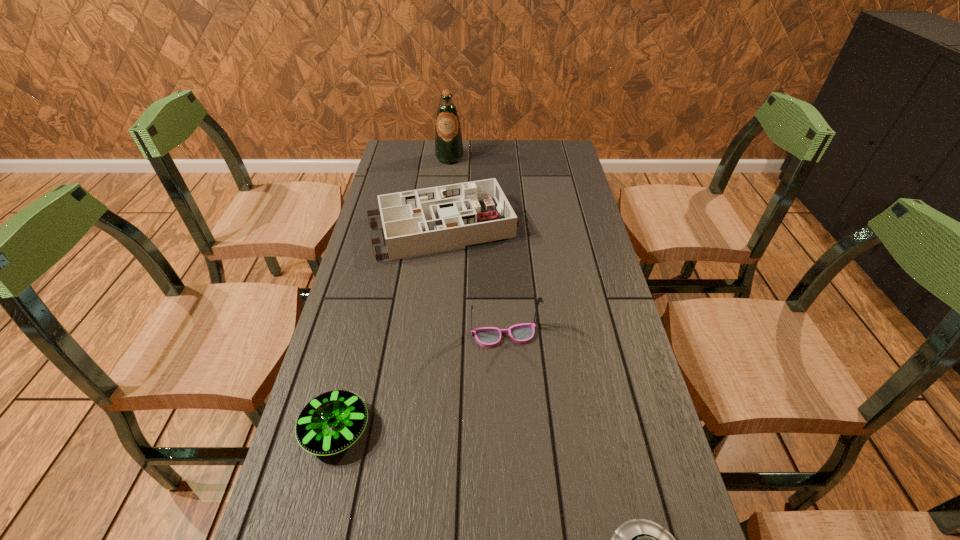
This screenshot has height=540, width=960. In order to click on vacant region located 0.250m on the right of the fourth farthest object in this screenshot , I will do `click(489, 430)`.

This screenshot has width=960, height=540. I want to click on object that is at the far edge, so click(448, 140).

The height and width of the screenshot is (540, 960). In order to click on dollhouse at the left edge in this screenshot , I will do coord(417,222).

Where is `saucer that is at the left edge`? The width and height of the screenshot is (960, 540). saucer that is at the left edge is located at coordinates (331, 422).

At what (x,y) coordinates should I click in order to perform the action: click on vacant region at the far edge of the desktop. Please return your answer as a coordinate pair (x, y). The height and width of the screenshot is (540, 960). Looking at the image, I should click on (504, 163).

The image size is (960, 540). In the image, there is a desktop. Find the location of `vacant space at the left edge`. vacant space at the left edge is located at coordinates click(348, 288).

Find the location of `free region at the right edge`. free region at the right edge is located at coordinates click(x=606, y=510).

Where is `empty space between the fourth nearest object and the third nearest object`? The height and width of the screenshot is (540, 960). empty space between the fourth nearest object and the third nearest object is located at coordinates (473, 281).

This screenshot has height=540, width=960. What are the coordinates of `vacant space that is in between the fourth nearest object and the second nearest object` in the screenshot? It's located at (389, 329).

Image resolution: width=960 pixels, height=540 pixels. I want to click on blank region between the third nearest object and the tallest object, so click(477, 247).